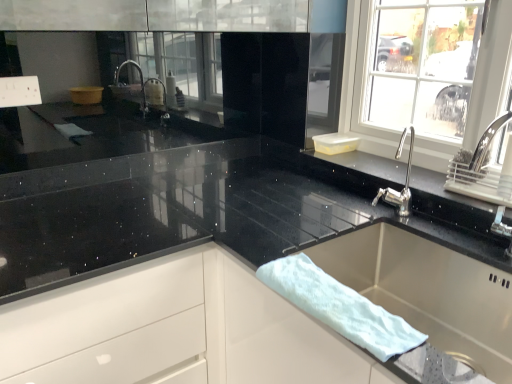
The height and width of the screenshot is (384, 512). What are the coordinates of `free space above white fluffy bath towel at sink (from a real-world perspective)` in the screenshot? It's located at (322, 289).